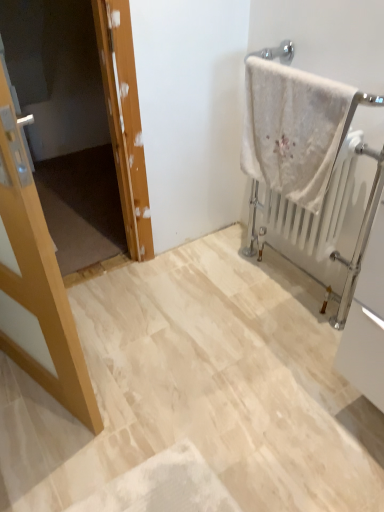
The image size is (384, 512). Identify the location of free space between light wood door at left and white metallic radiator at right. (189, 328).